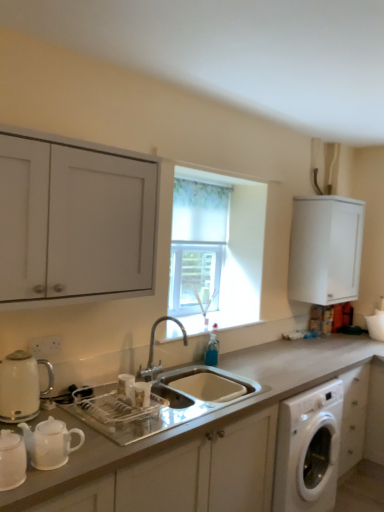
Question: In terms of width, does white matte countertop at center look wider or thinner when compared to translucent fabric curtain at center?

Choices:
 (A) thin
 (B) wide

Answer: (B)

Question: From the image's perspective, is white matte countertop at center above or below translucent fabric curtain at center?

Choices:
 (A) above
 (B) below

Answer: (B)

Question: Which is farther from the silver metallic faucet at center?

Choices:
 (A) translucent fabric curtain at center
 (B) matte white kettle at left
 (C) white matte cabinet at upper right, which ranks as the 1th cabinetry in right-to-left order
 (D) white matte cabinet at upper left, which is counted as the first cabinetry, starting from the front
 (E) white matte countertop at center

Answer: (C)

Question: Which of these objects is positioned farthest from the translucent fabric curtain at center?

Choices:
 (A) white matte cabinet at upper left, marked as the 2th cabinetry in a back-to-front arrangement
 (B) white matte cabinet at upper right, the first cabinetry from the back
 (C) matte white kettle at left
 (D) silver metallic faucet at center
 (E) white matte countertop at center

Answer: (C)